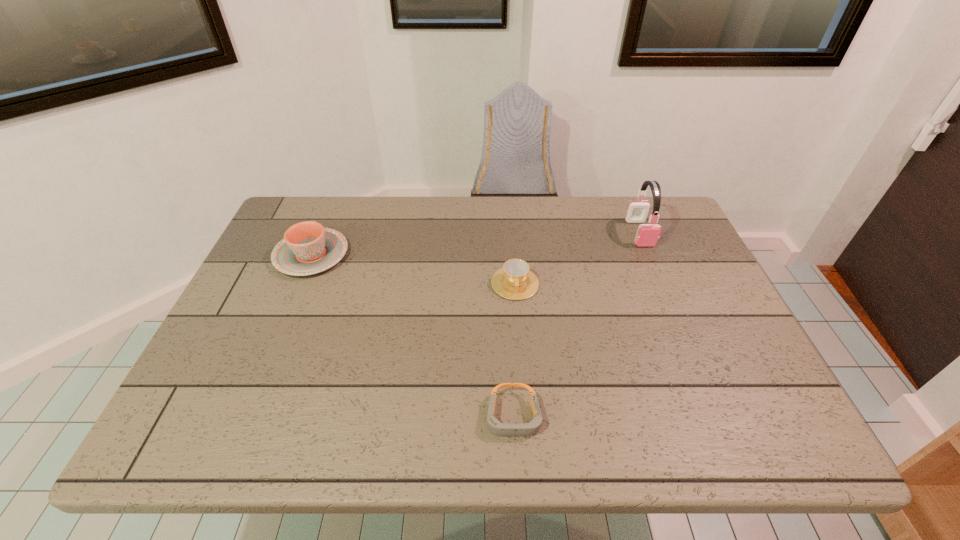
Where is `free space at the left edge of the desktop`? free space at the left edge of the desktop is located at coordinates (242, 302).

Locate an element on the screen. The image size is (960, 540). vacant space at the right edge of the desktop is located at coordinates (684, 265).

Find the location of `vacant space at the far left corner of the desktop`. vacant space at the far left corner of the desktop is located at coordinates (282, 235).

Find the location of a particular element. The image size is (960, 540). blank space at the near left corner of the desktop is located at coordinates (195, 433).

This screenshot has height=540, width=960. I want to click on free area in between the leftmost object and the third tallest object, so click(414, 269).

You are a GUI agent. You are given a task and a screenshot of the screen. Output one action in this format:
    pyautogui.click(x=<x>, y=<y>)
    Task: Click on the vacant space in between the tallest object and the nearest object
    This screenshot has width=960, height=540.
    Given the screenshot: What is the action you would take?
    pyautogui.click(x=576, y=325)

Find the location of `vacant area that lies between the goggles and the earphone`. vacant area that lies between the goggles and the earphone is located at coordinates (576, 325).

This screenshot has width=960, height=540. In order to click on free spot between the chinaware and the goggles in this screenshot , I will do `click(413, 336)`.

In order to click on free space between the second shortest object and the third shortest object in this screenshot , I will do `click(414, 269)`.

In order to click on free spot between the nearest object and the third shortest object in this screenshot , I will do `click(413, 336)`.